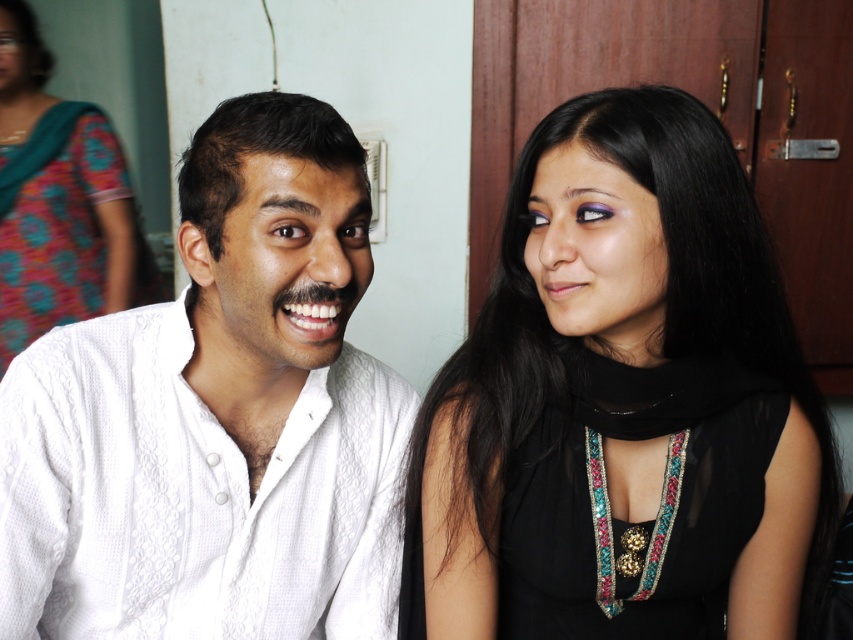
You are a photographer setting up a shoot in this scene. You need to position a light source above the black satin dress at center so that it illuminates the white textured shirt at left. Is this possible given their positions?

The black satin dress at center is located below the white textured shirt at left, so placing a light source above the dress would naturally illuminate the shirt since it is positioned higher.

Based on the photo, you are a photographer setting up for a photoshoot. You need to position a light source so that it illuminates both the black satin dress at center and the white textured shirt at left without casting harsh shadows. Considering their positions, where should you place the light source relative to the two outfits?

The white textured shirt at left is behind the black satin dress at center, so placing the light source in front of both outfits, angled slightly towards the back, would ensure both are well lit while minimizing harsh shadows.

You are a photographer setting up for a photoshoot. You need to decide which garment to use based on length. The scene has a black satin dress at center and a teal floral sari at upper left. Which garment should you choose if you want the longer one?

The teal floral sari at upper left is longer than the black satin dress at center, so you should choose the teal floral sari at upper left.